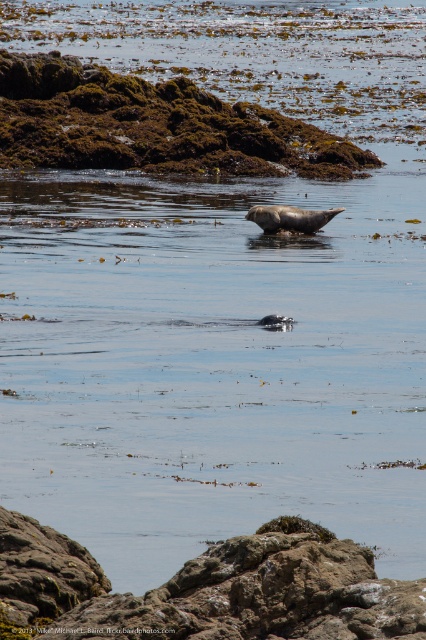
You are a photographer standing at the edge of the water in the coastal scene. You want to take a photo that includes both points marked as point (x=301, y=435) and point (x=11, y=536). Which point will appear closer to the front of the photo?

Point (x=11, y=536) will appear closer to the front of the photo because it is closer to the camera than point (x=301, y=435), which is further away.

You are a marine biologist observing the coastal scene. You notice the clear water at center and the brown rough rock at center. Which object is higher in elevation compared to the other?

The clear water at center is much taller than the brown rough rock at center, so the clear water at center has a higher elevation.